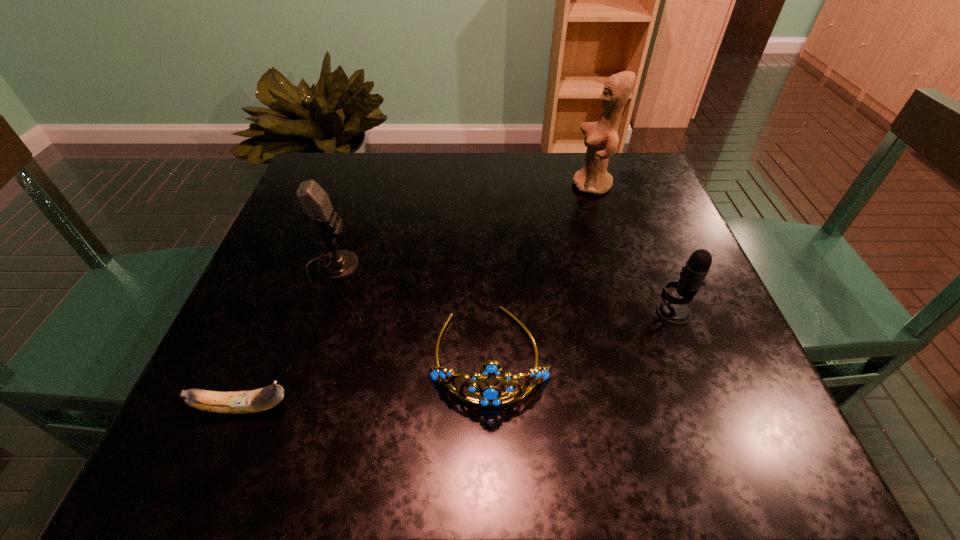
The height and width of the screenshot is (540, 960). In order to click on microphone at the right edge in this screenshot , I will do `click(673, 310)`.

At what (x,y) coordinates should I click in order to perform the action: click on object that is at the near left corner. Please return your answer as a coordinate pair (x, y). The height and width of the screenshot is (540, 960). Looking at the image, I should click on (238, 402).

Where is `object that is positioned at the far right corner`? The height and width of the screenshot is (540, 960). object that is positioned at the far right corner is located at coordinates (601, 138).

This screenshot has height=540, width=960. In the image, there is a desktop. Identify the location of free space at the far edge. (383, 177).

The height and width of the screenshot is (540, 960). In order to click on vacant space at the near edge in this screenshot , I will do `click(613, 441)`.

The width and height of the screenshot is (960, 540). I want to click on vacant area at the left edge of the desktop, so click(324, 325).

In the image, there is a desktop. Where is `vacant space at the right edge`? The image size is (960, 540). vacant space at the right edge is located at coordinates (654, 306).

The height and width of the screenshot is (540, 960). I want to click on free region at the far left corner, so click(350, 153).

The width and height of the screenshot is (960, 540). Identify the location of free point at the near left corner. pyautogui.click(x=190, y=469).

Where is `free space at the far right corner of the desktop`? The width and height of the screenshot is (960, 540). free space at the far right corner of the desktop is located at coordinates (655, 203).